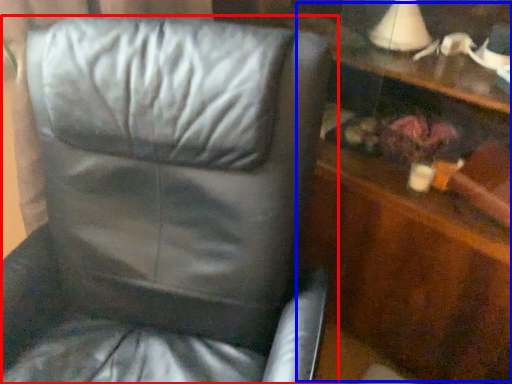
Question: Which of the following is the farthest to the observer, chair (highlighted by a red box) or dresser (highlighted by a blue box)?

Choices:
 (A) chair
 (B) dresser

Answer: (B)